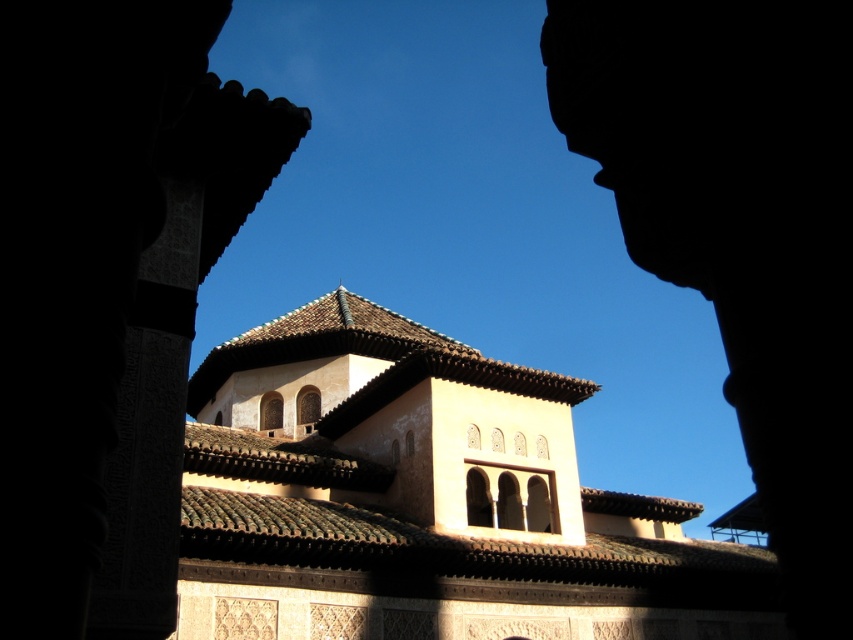
You are standing in the courtyard and want to place a small decorative pot between the two points, point (616, 529) and point (848, 294). Which point should you place it closer to if you want it to be closer to the viewer?

Answer: You should place the pot closer to point (616, 529) because it is closer to the viewer than point (848, 294).

You are an architect analyzing the structure of the beige stucco church at center and the dark stone arch at center. Which structure has a greater height?

The beige stucco church at center is much taller than the dark stone arch at center, so the beige stucco church at center has a greater height.

You are standing in a courtyard and want to walk towards the beige stucco church at center and the dark stone arch at center. Which one will you reach first?

You will reach the beige stucco church at center first because it is closer to you than the dark stone arch at center.